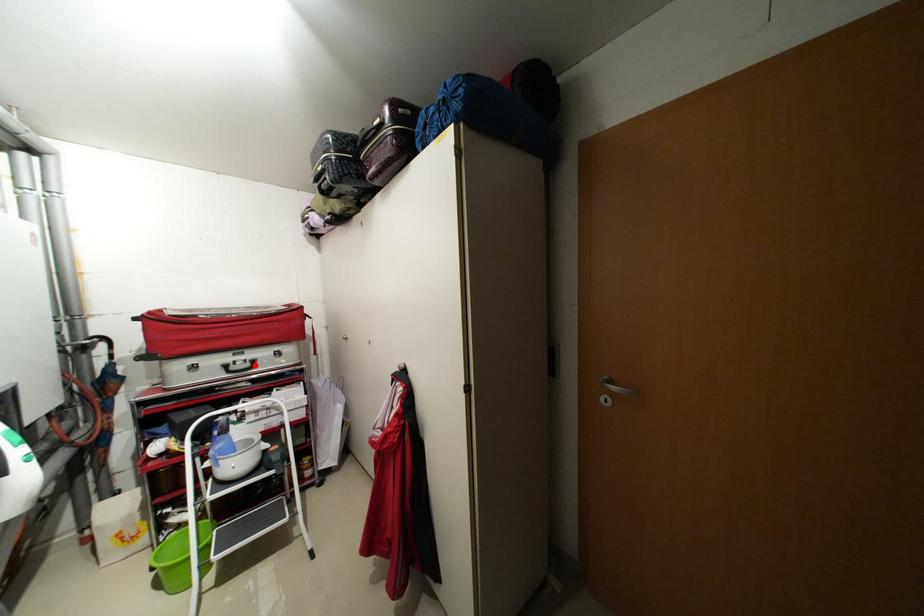
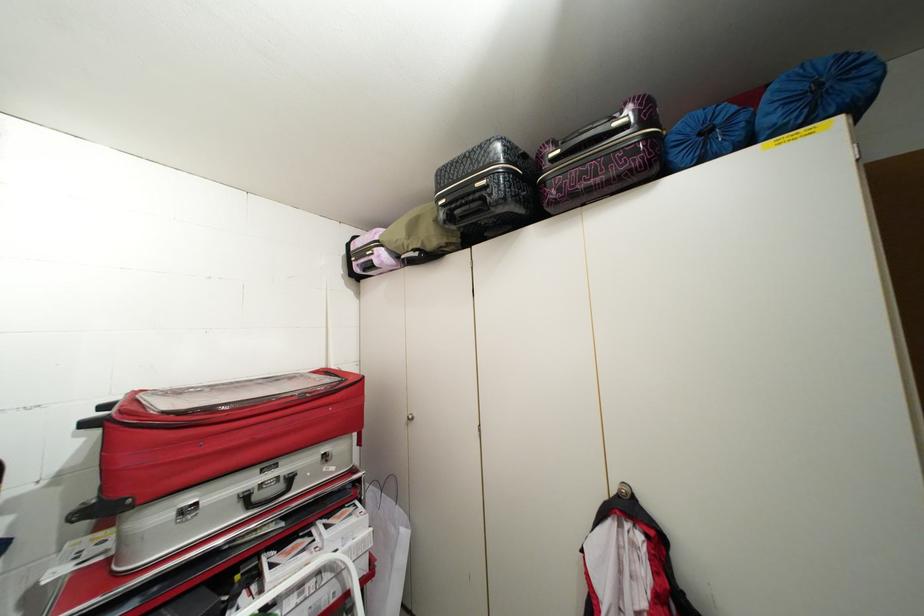
The point at the highlighted location is marked in the first image. Where is the corresponding point in the second image?

(287, 487)